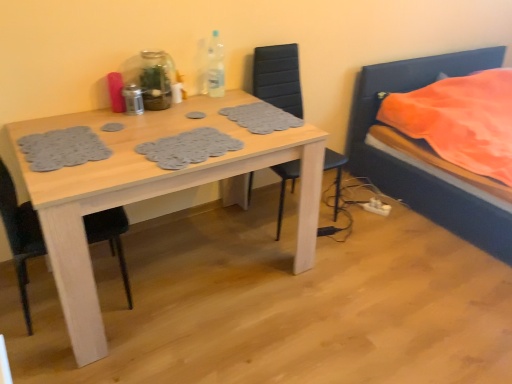
Identify the location of vacant region under black leather chair at center, marked as the 2th chair in a left-to-right arrangement (from a real-world perspective). (282, 211).